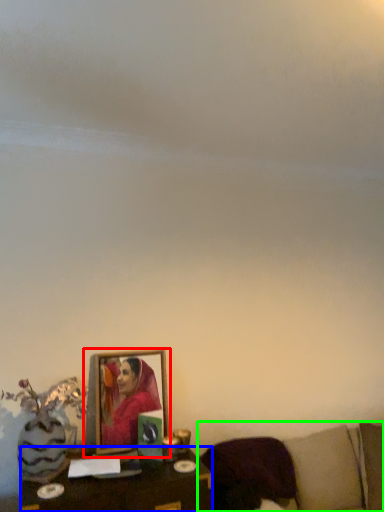
Question: Based on their relative distances, which object is nearer to picture frame (highlighted by a red box)? Choose from table (highlighted by a blue box) and furniture (highlighted by a green box).

Choices:
 (A) table
 (B) furniture

Answer: (A)